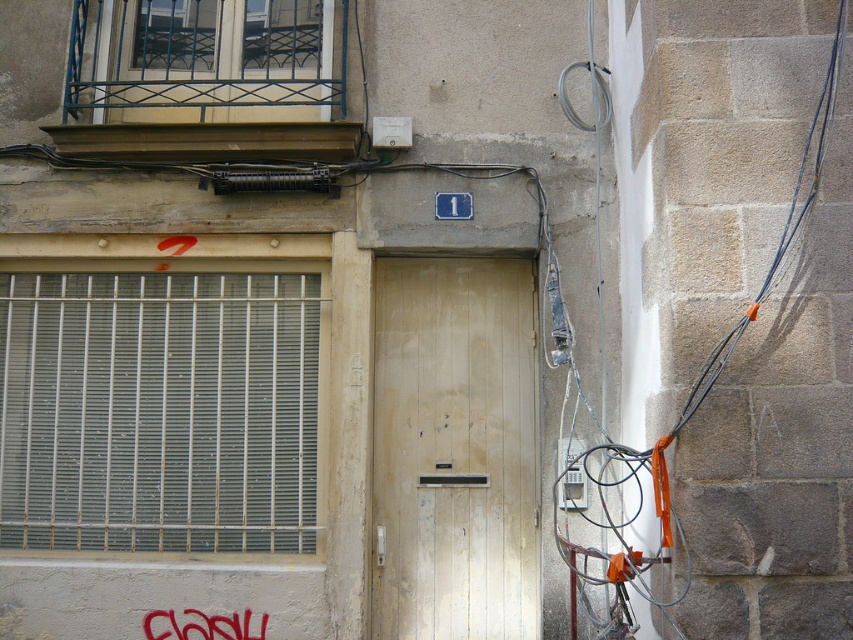
Question: Is orange fabric at right below white wood door at center?

Choices:
 (A) no
 (B) yes

Answer: (A)

Question: Among these points, which one is nearest to the camera?

Choices:
 (A) (202, 630)
 (B) (436, 397)

Answer: (A)

Question: Which object is farther from the camera taking this photo?

Choices:
 (A) orange fabric at right
 (B) white wood door at center

Answer: (B)

Question: Does white wood door at center appear over brushed metal graffiti at lower left?

Choices:
 (A) no
 (B) yes

Answer: (B)

Question: Can you confirm if orange fabric at right is positioned above white wood door at center?

Choices:
 (A) no
 (B) yes

Answer: (B)

Question: Considering the real-world distances, which object is closest to the brushed metal graffiti at lower left?

Choices:
 (A) orange fabric at right
 (B) white wood door at center

Answer: (B)